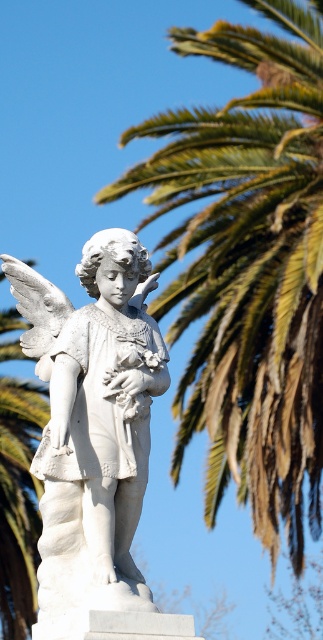
Does point (231, 330) come behind point (104, 525)?

That is True.

Is green leafy palm at upper right positioned before white marble statue at center?

No, it is behind white marble statue at center.

Is point (208, 465) less distant than point (164, 362)?

No, (208, 465) is further to viewer.

Identify the location of green leafy palm at upper right. The height and width of the screenshot is (640, 323). (248, 268).